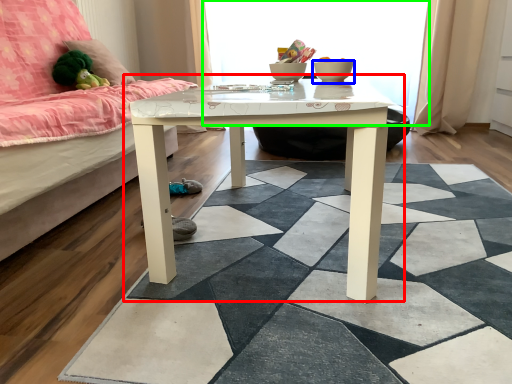
Question: Considering the real-world distances, which object is farthest from table (highlighted by a red box)? glass bowl (highlighted by a blue box) or window screen (highlighted by a green box)?

Choices:
 (A) glass bowl
 (B) window screen

Answer: (B)